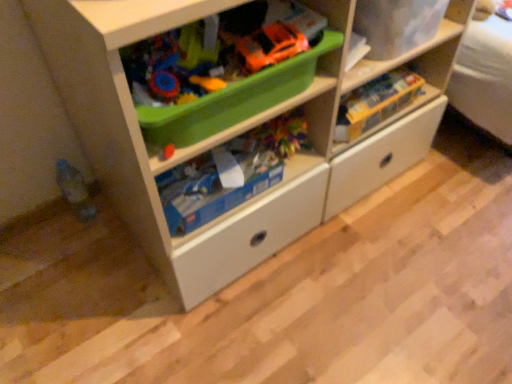
Question: Is matte plastic storage box at upper right inside the boundaries of blue cardboard box at center, the 2th toy when ordered from right to left, or outside?

Choices:
 (A) inside
 (B) outside

Answer: (B)

Question: In the image, is matte plastic storage box at upper right positioned in front of or behind blue cardboard box at center, placed as the 2th toy when sorted from left to right?

Choices:
 (A) behind
 (B) front

Answer: (B)

Question: Estimate the real-world distances between objects in this image. Which object is farther from the blue cardboard box at center, placed as the 2th toy when sorted from left to right?

Choices:
 (A) matte plastic toy at lower left, the first toy positioned from the left
 (B) orange matte toy car at upper center
 (C) white matte chest of drawers at center
 (D) green plastic container at upper center
 (E) matte plastic storage box at upper right

Answer: (A)

Question: Which object is the closest to the yellow cardboard box at upper right, which appears as the first toy when viewed from the right?

Choices:
 (A) white matte chest of drawers at center
 (B) blue cardboard box at center, placed as the 2th toy when sorted from left to right
 (C) orange matte toy car at upper center
 (D) matte plastic toy at lower left, the third toy from the right
 (E) matte plastic storage box at upper right

Answer: (E)